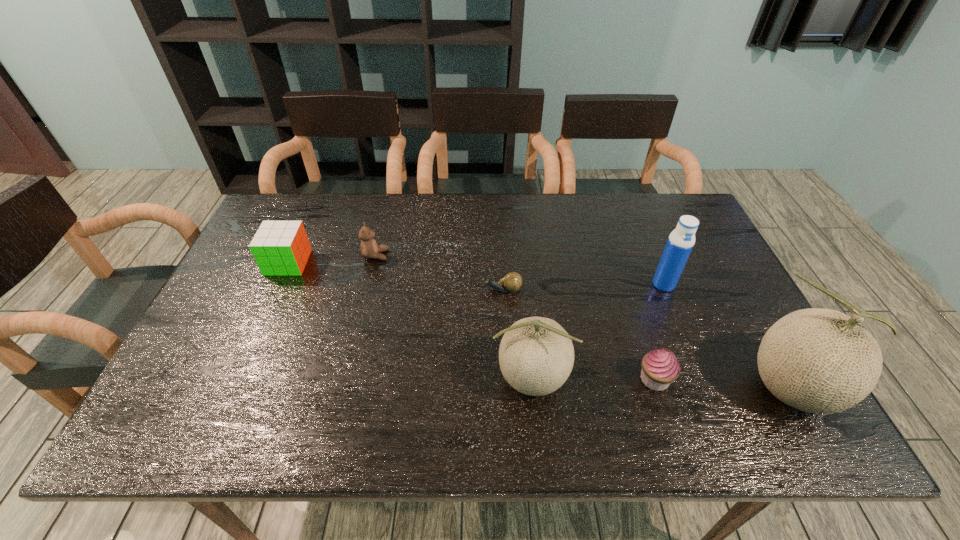
Where is `free space located on the front-facing side of the escargot`? This screenshot has width=960, height=540. free space located on the front-facing side of the escargot is located at coordinates (445, 289).

At what (x,y) coordinates should I click in order to perform the action: click on free space located on the front-facing side of the escargot. Please return your answer as a coordinate pair (x, y). This screenshot has width=960, height=540. Looking at the image, I should click on (387, 289).

At what (x,y) coordinates should I click in order to perform the action: click on vacant space located 0.170m on the front-facing side of the escargot. Please return your answer as a coordinate pair (x, y). Looking at the image, I should click on (420, 289).

Where is `vacant position located on the front of the cube`? This screenshot has width=960, height=540. vacant position located on the front of the cube is located at coordinates (242, 365).

Find the location of `vacant region located 0.180m on the front-facing side of the teddy bear`. vacant region located 0.180m on the front-facing side of the teddy bear is located at coordinates (448, 255).

At what (x,y) coordinates should I click in order to perform the action: click on free space located 0.350m on the back of the cupcake. Please return your answer as a coordinate pair (x, y). The height and width of the screenshot is (540, 960). Looking at the image, I should click on (617, 264).

You are a GUI agent. You are given a task and a screenshot of the screen. Output one action in this format:
    pyautogui.click(x=<x>, y=<y>)
    Task: Click on the cupcake that is at the near edge
    The image size is (960, 540).
    Given the screenshot: What is the action you would take?
    pyautogui.click(x=660, y=367)

Locate an element on the screen. The image size is (960, 540). object at the left edge is located at coordinates (281, 248).

Identify the location of cantaloup that is positioned at the right edge. (822, 361).

The height and width of the screenshot is (540, 960). What are the coordinates of `water bottle that is at the right edge` in the screenshot? It's located at (680, 243).